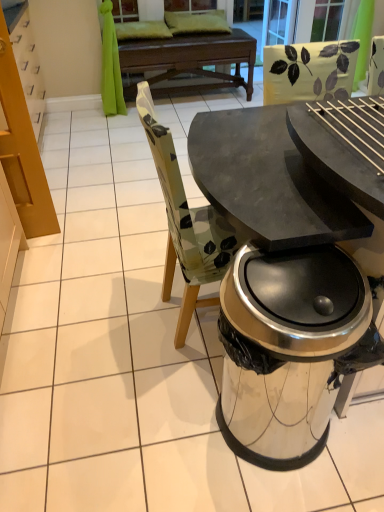
Question: Should I look upward or downward to see clear glass screen door at upper center, which is the 1th screen door from right to left?

Choices:
 (A) down
 (B) up

Answer: (B)

Question: Does clear glass screen door at upper center, which is the 2th screen door in left-to-right order, have a lesser width compared to transparent glass screen door at upper center, which is the 1th screen door in left-to-right order?

Choices:
 (A) no
 (B) yes

Answer: (B)

Question: Considering the relative positions of clear glass screen door at upper center, which is the 1th screen door from right to left, and transparent glass screen door at upper center, which is the 1th screen door in left-to-right order, in the image provided, is clear glass screen door at upper center, which is the 1th screen door from right to left, to the left of transparent glass screen door at upper center, which is the 1th screen door in left-to-right order, from the viewer's perspective?

Choices:
 (A) no
 (B) yes

Answer: (A)

Question: From a real-world perspective, does clear glass screen door at upper center, which is the 1th screen door from right to left, sit lower than transparent glass screen door at upper center, the 2th screen door positioned from the right?

Choices:
 (A) no
 (B) yes

Answer: (A)

Question: Considering the relative sizes of clear glass screen door at upper center, which is the 2th screen door in left-to-right order, and transparent glass screen door at upper center, which is the 1th screen door in left-to-right order, in the image provided, is clear glass screen door at upper center, which is the 2th screen door in left-to-right order, wider than transparent glass screen door at upper center, which is the 1th screen door in left-to-right order,?

Choices:
 (A) no
 (B) yes

Answer: (A)

Question: Is the position of clear glass screen door at upper center, which is the 2th screen door in left-to-right order, more distant than that of transparent glass screen door at upper center, the 2th screen door positioned from the right?

Choices:
 (A) yes
 (B) no

Answer: (B)

Question: Does clear glass screen door at upper center, which is the 1th screen door from right to left, have a lesser height compared to transparent glass screen door at upper center, the 2th screen door positioned from the right?

Choices:
 (A) no
 (B) yes

Answer: (B)

Question: Is clear glass screen door at upper center, which is the 1th screen door from right to left, closer to camera compared to shiny metallic trash can at lower right?

Choices:
 (A) yes
 (B) no

Answer: (B)

Question: Does clear glass screen door at upper center, which is the 2th screen door in left-to-right order, have a larger size compared to shiny metallic trash can at lower right?

Choices:
 (A) yes
 (B) no

Answer: (B)

Question: Can you confirm if clear glass screen door at upper center, which is the 1th screen door from right to left, is wider than shiny metallic trash can at lower right?

Choices:
 (A) yes
 (B) no

Answer: (B)

Question: Would you consider clear glass screen door at upper center, which is the 1th screen door from right to left, to be distant from shiny metallic trash can at lower right?

Choices:
 (A) yes
 (B) no

Answer: (A)

Question: Is clear glass screen door at upper center, which is the 1th screen door from right to left, facing away from shiny metallic trash can at lower right?

Choices:
 (A) yes
 (B) no

Answer: (B)

Question: Could shiny metallic trash can at lower right be considered to be inside clear glass screen door at upper center, which is the 1th screen door from right to left?

Choices:
 (A) no
 (B) yes

Answer: (A)

Question: From the image's perspective, would you say shiny metallic trash can at lower right is positioned over transparent glass screen door at upper center, the 2th screen door positioned from the right?

Choices:
 (A) no
 (B) yes

Answer: (A)